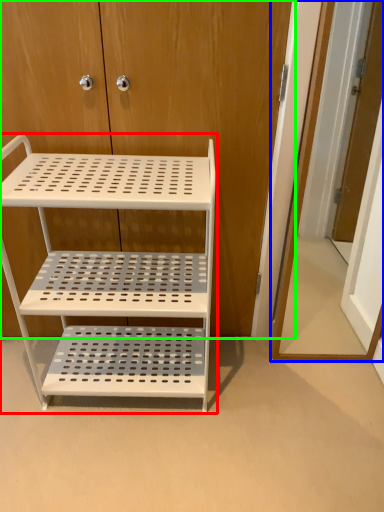
Question: Considering the real-world distances, which object is farthest from shelf (highlighted by a red box)? door (highlighted by a blue box) or dresser (highlighted by a green box)?

Choices:
 (A) door
 (B) dresser

Answer: (A)